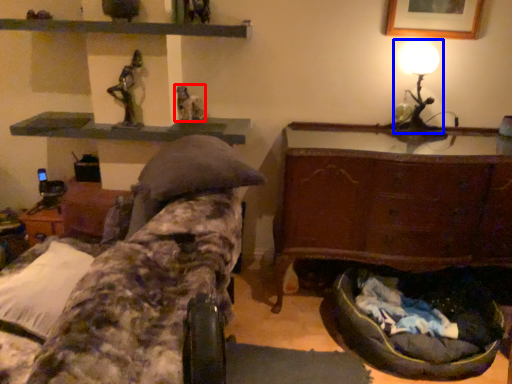
Question: Which of the following is the farthest to the observer, sculpture (highlighted by a red box) or table lamp (highlighted by a blue box)?

Choices:
 (A) sculpture
 (B) table lamp

Answer: (A)